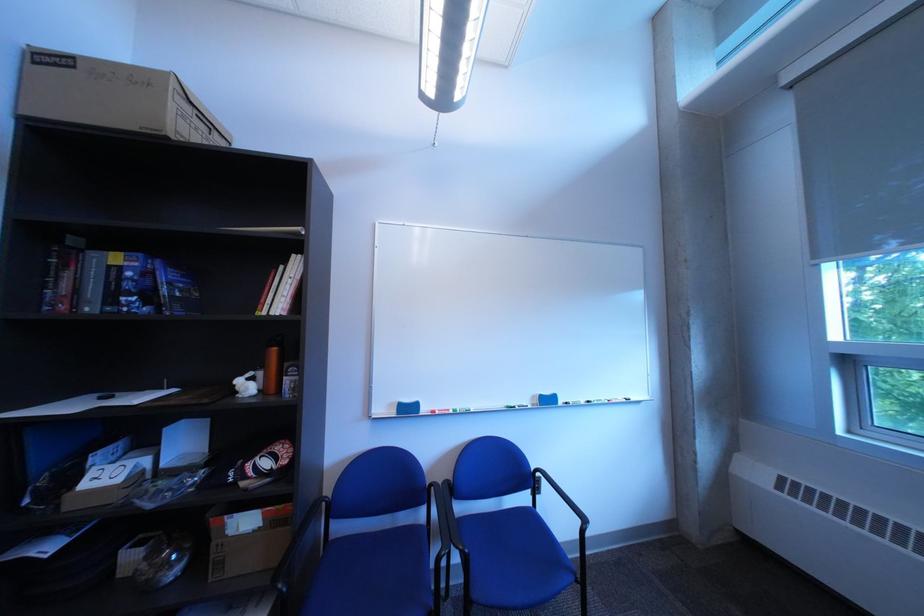
Find where to pull the light fixture pull-chain. Please return your answer as a coordinate pair (x, y).

(435, 130)